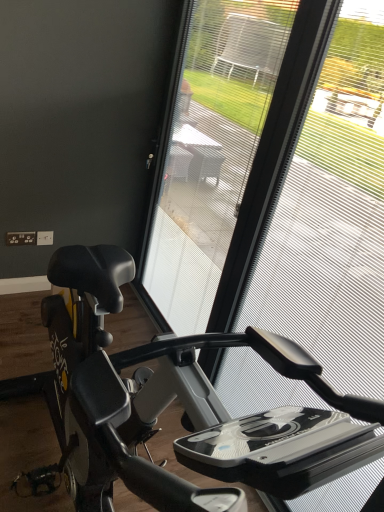
Question: Is transparent plastic screen door at center situated inside transparent mesh at center or outside?

Choices:
 (A) outside
 (B) inside

Answer: (A)

Question: Is transparent plastic screen door at center in front of or behind transparent mesh at center in the image?

Choices:
 (A) front
 (B) behind

Answer: (B)

Question: Which is farther from the transparent mesh at center?

Choices:
 (A) black matte stationary bicycle at center
 (B) transparent plastic screen door at center

Answer: (A)

Question: Which object is positioned closest to the transparent mesh at center?

Choices:
 (A) black matte stationary bicycle at center
 (B) transparent plastic screen door at center

Answer: (B)